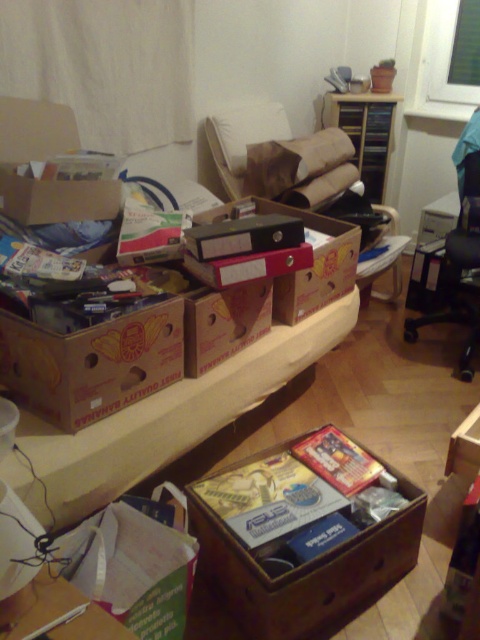
Is brown cardboard box at center to the right of black plastic swivel chair at right from the viewer's perspective?

Incorrect, brown cardboard box at center is not on the right side of black plastic swivel chair at right.

Identify the location of brown cardboard box at center. (92, 362).

The width and height of the screenshot is (480, 640). What are the coordinates of `brown cardboard box at center` in the screenshot? It's located at pyautogui.click(x=92, y=362).

Is wooden box at center shorter than brown cardboard box at center?

Incorrect, wooden box at center's height does not fall short of brown cardboard box at center's.

Looking at this image, who is positioned more to the right, wooden box at center or brown cardboard box at center?

wooden box at center is more to the right.

The height and width of the screenshot is (640, 480). I want to click on wooden box at center, so click(x=303, y=534).

Between brown cardboard box at center and brown cardboard swivel chair at center, which one has less height?

Standing shorter between the two is brown cardboard box at center.

Which is above, brown cardboard box at center or brown cardboard swivel chair at center?

brown cardboard swivel chair at center is higher up.

Between point (35, 397) and point (324, 189), which one is positioned behind?

Positioned behind is point (324, 189).

Image resolution: width=480 pixels, height=640 pixels. Identify the location of brown cardboard box at center. coord(92,362).